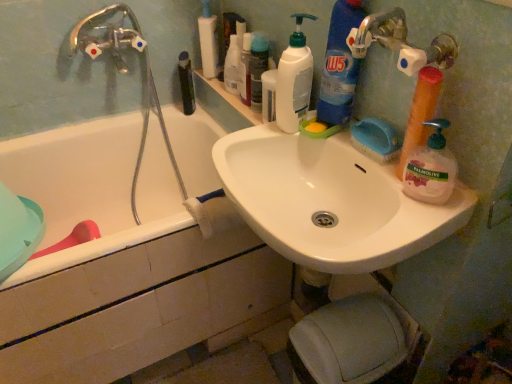
Question: Does point (317, 150) appear closer or farther from the camera than point (448, 163)?

Choices:
 (A) farther
 (B) closer

Answer: (A)

Question: From a real-world perspective, relative to palmolive liquid soap at right, which appears as the fourth cleaning product when viewed from the left, is white glossy sink at upper center vertically above or below?

Choices:
 (A) above
 (B) below

Answer: (B)

Question: Considering the real-world distances, which object is farthest from the white glossy sink at upper center?

Choices:
 (A) white plastic pump bottle at upper center, the first toiletry from the left
 (B) translucent plastic soap dispenser at upper center, the second toiletry from the right
 (C) green matte bottle at upper center
 (D) blue glossy detergent at upper right, positioned as the 2th cleaning product in left-to-right order
 (E) white ceramic bathtub at left

Answer: (C)

Question: Which object is the farthest from the blue glossy detergent at upper right, which ranks as the third cleaning product in right-to-left order?

Choices:
 (A) white glossy sink at upper center
 (B) translucent plastic soap dispenser at upper center, the second toiletry from the right
 (C) palmolive liquid soap at right, the first cleaning product viewed from the right
 (D) white ceramic bathtub at left
 (E) green matte bottle at upper center

Answer: (D)